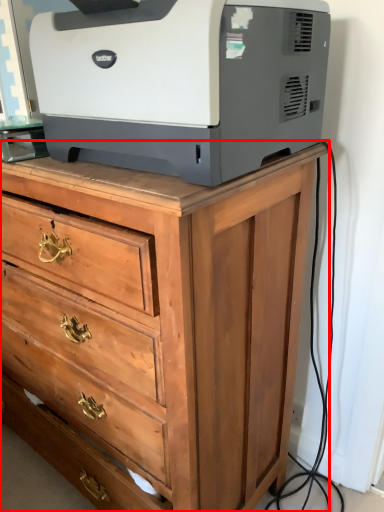
Question: From the image's perspective, what is the correct spatial relationship of chest of drawers (annotated by the red box) in relation to printer?

Choices:
 (A) above
 (B) below

Answer: (B)